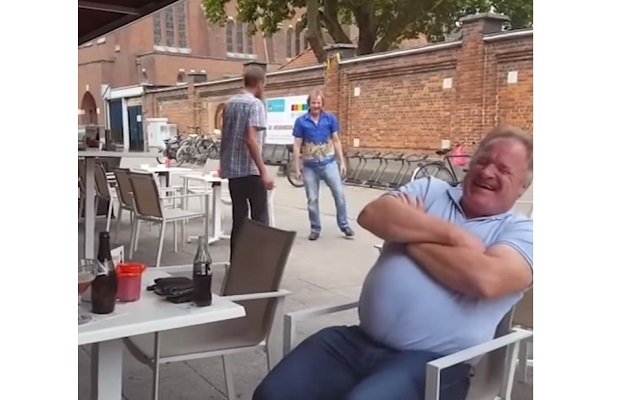
Where is `wall`? This screenshot has height=400, width=620. wall is located at coordinates (377, 101).